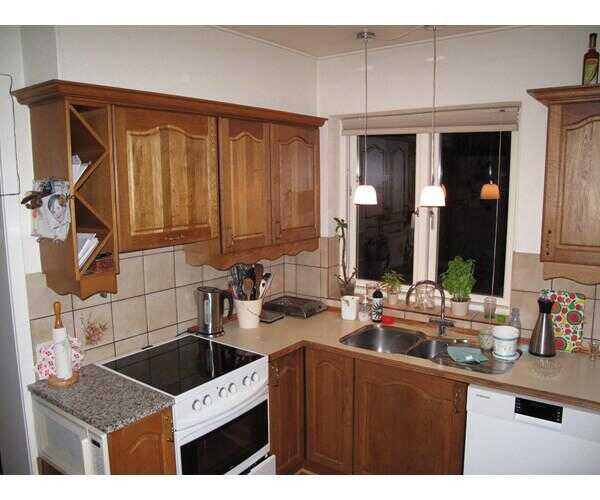
You are a GUI agent. You are given a task and a screenshot of the screen. Output one action in this format:
    pyautogui.click(x=<x>, y=<y>)
    Task: Click on the white walls
    This screenshot has height=500, width=600.
    Given the screenshot: What is the action you would take?
    pyautogui.click(x=110, y=52)